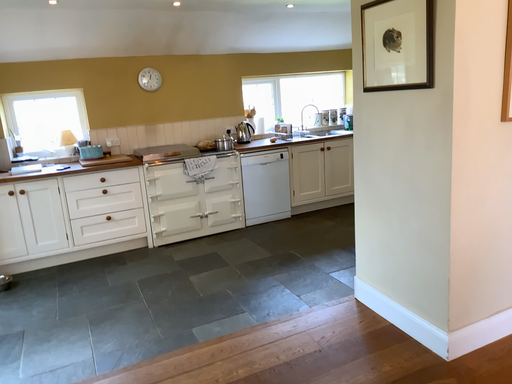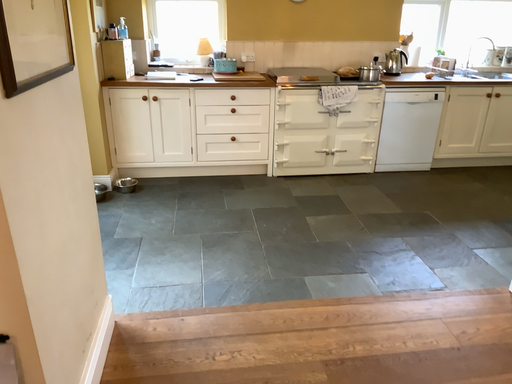
Question: Which way did the camera rotate in the video?

Choices:
 (A) rotated left
 (B) rotated right

Answer: (A)